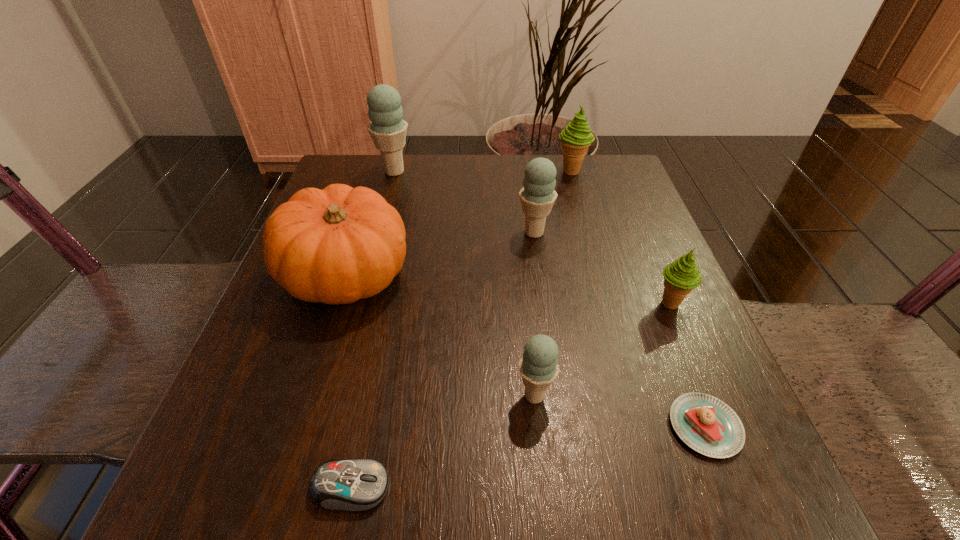
This screenshot has height=540, width=960. Identify the location of free space in the image that satisfies the following two spatial constraints: 1. on the front side of the second smallest blue ice cream; 2. on the wheel side of the nearest object. (570, 487).

Find the location of a particular element. vacant space that satisfies the following two spatial constraints: 1. on the front side of the pastry; 2. on the left side of the biggest blue ice cream is located at coordinates (326, 426).